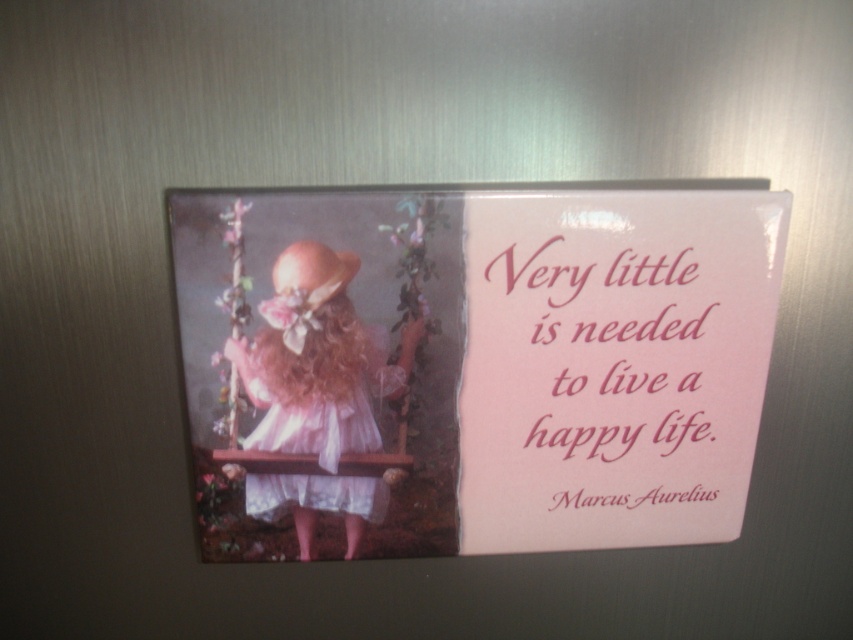
Can you confirm if pink paper plaque at center is thinner than pink satin dress at center?

In fact, pink paper plaque at center might be wider than pink satin dress at center.

The image size is (853, 640). In order to click on pink paper plaque at center in this screenshot , I will do `click(473, 365)`.

Which is above, pink paper plaque at center or pink paper quote at upper right?

pink paper quote at upper right

Is pink paper plaque at center above pink paper quote at upper right?

Incorrect, pink paper plaque at center is not positioned above pink paper quote at upper right.

Where is `pink paper plaque at center`? The width and height of the screenshot is (853, 640). pink paper plaque at center is located at coordinates (473, 365).

At what (x,y) coordinates should I click in order to perform the action: click on pink paper plaque at center. Please return your answer as a coordinate pair (x, y). The height and width of the screenshot is (640, 853). Looking at the image, I should click on (473, 365).

Is pink paper plaque at center further to camera compared to pastel pink lace dress at center?

That is False.

Does point (190, 301) come behind point (357, 403)?

That is False.

The height and width of the screenshot is (640, 853). What are the coordinates of `pink paper plaque at center` in the screenshot? It's located at (473, 365).